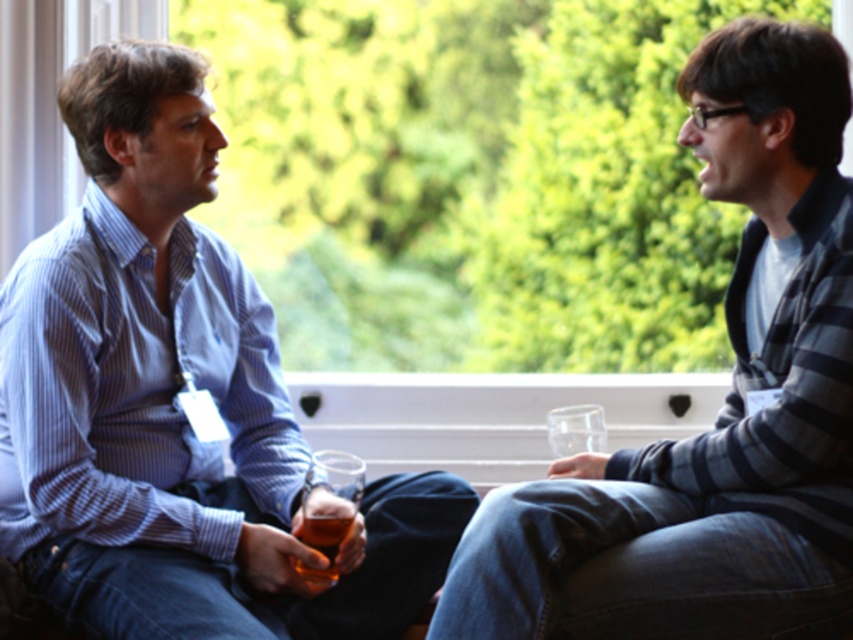
Can you confirm if matte blue shirt at left is positioned to the right of striped sweater at right?

Incorrect, matte blue shirt at left is not on the right side of striped sweater at right.

Between matte blue shirt at left and striped sweater at right, which one is positioned lower?

striped sweater at right is lower down.

Is point (415, 605) in front of point (828, 282)?

No.

The height and width of the screenshot is (640, 853). I want to click on matte blue shirt at left, so click(173, 404).

Identify the location of striped sweater at right. coord(720,410).

Between striped sweater at right and translucent glass beer at lower center, which one is positioned higher?

Positioned higher is striped sweater at right.

Which is behind, point (746, 488) or point (328, 522)?

The point (328, 522) is behind.

At what (x,y) coordinates should I click in order to perform the action: click on striped sweater at right. Please return your answer as a coordinate pair (x, y). The width and height of the screenshot is (853, 640). Looking at the image, I should click on (720, 410).

Is matte blue shirt at left taller than translucent glass beer at lower center?

Indeed, matte blue shirt at left has a greater height compared to translucent glass beer at lower center.

Does point (236, 406) lie behind point (325, 556)?

Yes.

Who is more forward, (96, 52) or (335, 524)?

Positioned in front is point (335, 524).

The image size is (853, 640). What are the coordinates of `matte blue shirt at left` in the screenshot? It's located at (173, 404).